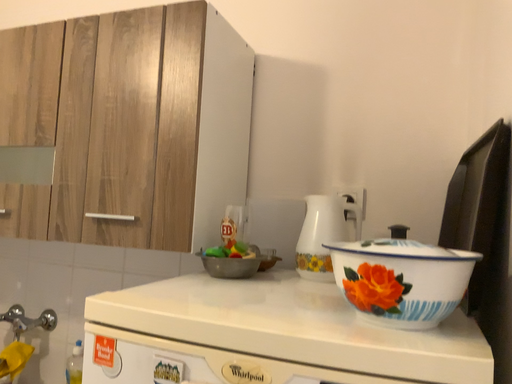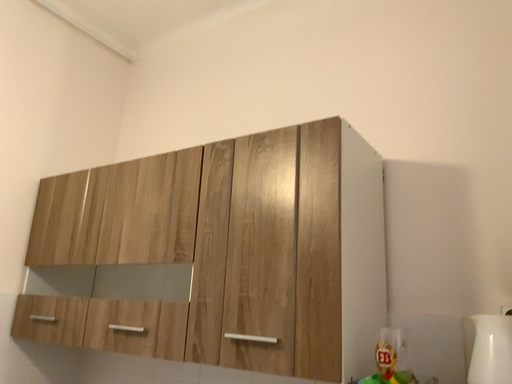
Question: Which way did the camera rotate in the video?

Choices:
 (A) rotated left
 (B) rotated right

Answer: (A)